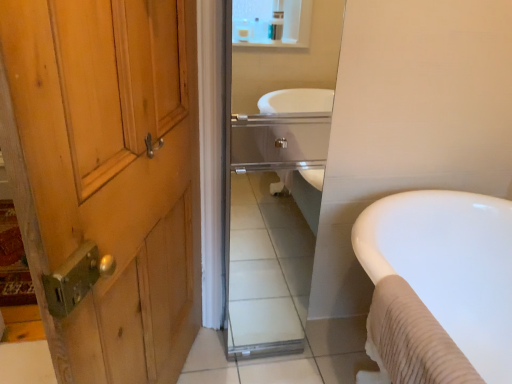
Question: Is glossy glass mirror at center shorter than white glossy bathtub at right?

Choices:
 (A) no
 (B) yes

Answer: (A)

Question: Is glossy glass mirror at center wider than white glossy bathtub at right?

Choices:
 (A) no
 (B) yes

Answer: (A)

Question: Can you confirm if glossy glass mirror at center is smaller than white glossy bathtub at right?

Choices:
 (A) no
 (B) yes

Answer: (B)

Question: Is glossy glass mirror at center touching white glossy bathtub at right?

Choices:
 (A) no
 (B) yes

Answer: (A)

Question: Is glossy glass mirror at center at the left side of white glossy bathtub at right?

Choices:
 (A) no
 (B) yes

Answer: (B)

Question: Considering the relative sizes of glossy glass mirror at center and white glossy bathtub at right in the image provided, is glossy glass mirror at center thinner than white glossy bathtub at right?

Choices:
 (A) no
 (B) yes

Answer: (B)

Question: From the image's perspective, does white glossy bathtub at right appear higher than glossy glass mirror at center?

Choices:
 (A) yes
 (B) no

Answer: (B)

Question: Considering the relative sizes of white glossy bathtub at right and glossy glass mirror at center in the image provided, is white glossy bathtub at right bigger than glossy glass mirror at center?

Choices:
 (A) no
 (B) yes

Answer: (B)

Question: From a real-world perspective, is white glossy bathtub at right on glossy glass mirror at center?

Choices:
 (A) no
 (B) yes

Answer: (A)

Question: Could glossy glass mirror at center be considered to be inside white glossy bathtub at right?

Choices:
 (A) yes
 (B) no

Answer: (B)

Question: Does white glossy bathtub at right appear on the right side of glossy glass mirror at center?

Choices:
 (A) yes
 (B) no

Answer: (A)

Question: Can you see white glossy bathtub at right touching glossy glass mirror at center?

Choices:
 (A) yes
 (B) no

Answer: (B)

Question: Based on their sizes in the image, would you say white glossy bathtub at right is bigger or smaller than glossy glass mirror at center?

Choices:
 (A) big
 (B) small

Answer: (A)